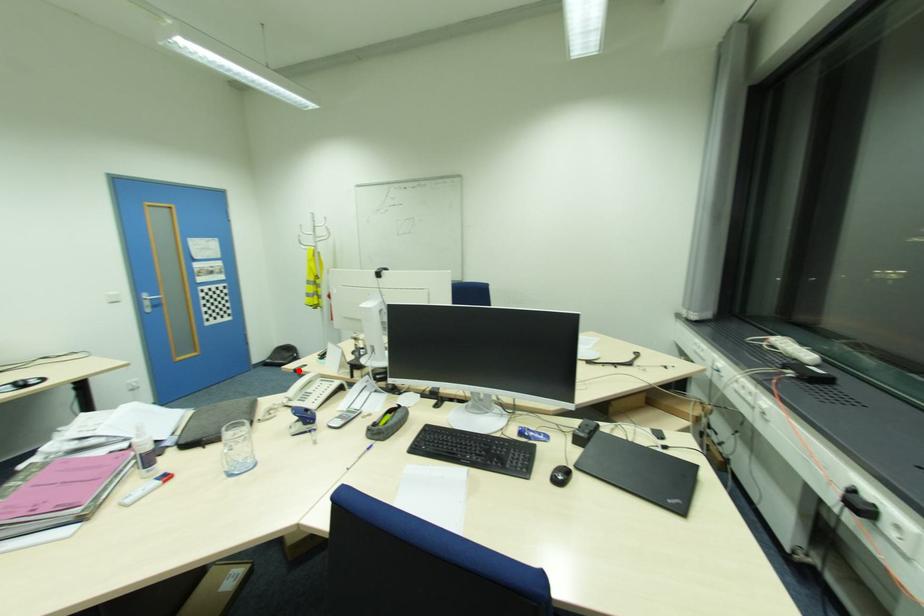
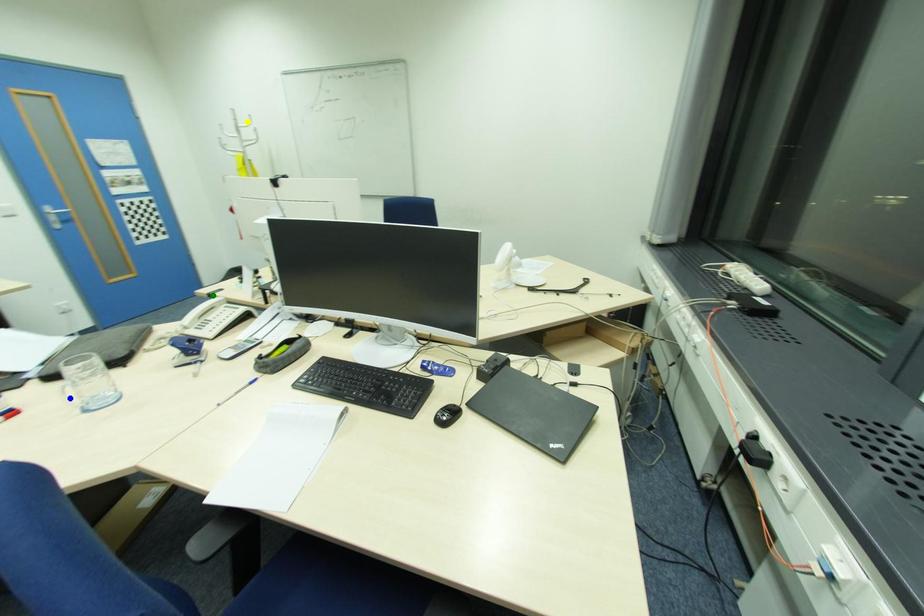
Question: I am providing you with two images of the same scene from different viewpoints. A red point is marked on the first image. You are given multiple points on the second image. In image 2, which mark is for the same physical point as the one in image 1?

Choices:
 (A) blue point
 (B) green point
 (C) yellow point

Answer: (B)